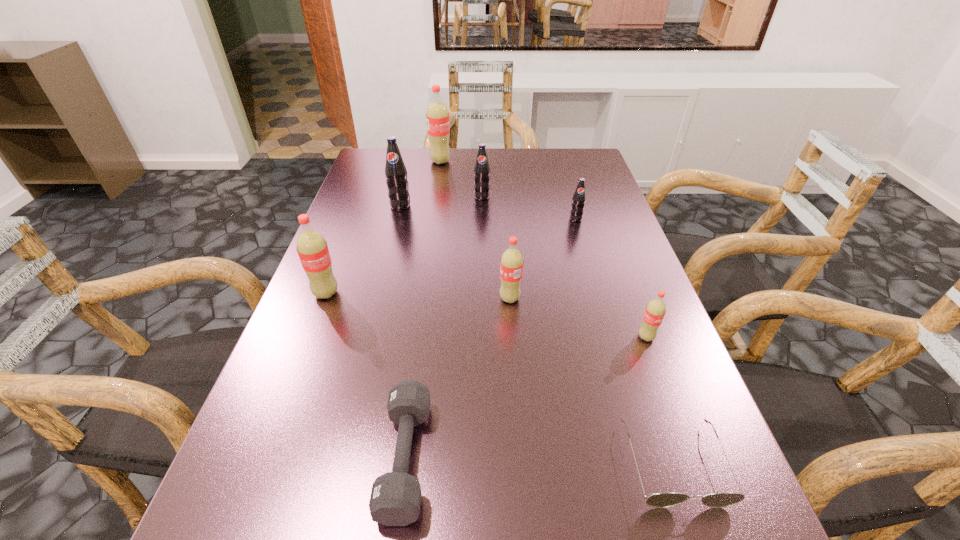
Identify which black pop is the third nearest to the tallest soda. Please provide its 2D coordinates. Your answer should be formatted as a tuple, i.e. [(x, y)], where the tuple contains the x and y coordinates of a point satisfying the conditions above.

[(578, 200)]

At what (x,y) coordinates should I click in order to perform the action: click on vacant position in the image that satisfies the following two spatial constraints: 1. on the front side of the second smallest red soda; 2. on the right side of the rightmost red soda. Please return your answer as a coordinate pair (x, y). The height and width of the screenshot is (540, 960). Looking at the image, I should click on 513,337.

Where is `free space that satisfies the following two spatial constraints: 1. on the front side of the second red soda from right to left; 2. on the left side of the smallest red soda`? free space that satisfies the following two spatial constraints: 1. on the front side of the second red soda from right to left; 2. on the left side of the smallest red soda is located at coordinates (513, 337).

You are a GUI agent. You are given a task and a screenshot of the screen. Output one action in this format:
    pyautogui.click(x=<x>, y=<y>)
    Task: Click on the free space that satisfies the following two spatial constraints: 1. on the front label of the rightmost black pop; 2. on the left side of the nearest red soda
    This screenshot has width=960, height=540.
    Given the screenshot: What is the action you would take?
    pyautogui.click(x=611, y=337)